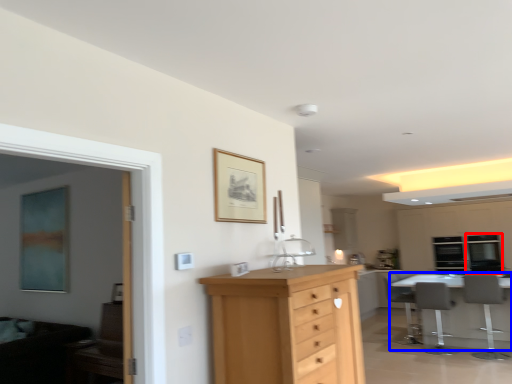
Question: Among these objects, which one is nearest to the camera, window (highlighted by a red box) or table (highlighted by a blue box)?

Choices:
 (A) window
 (B) table

Answer: (B)